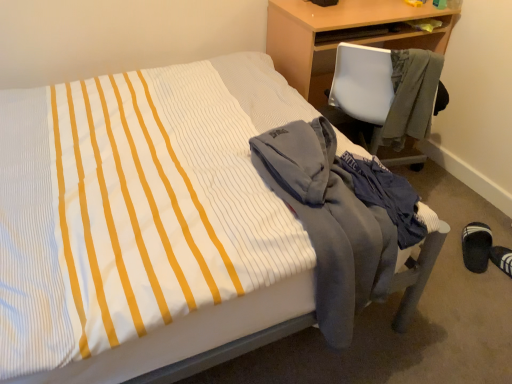
Question: Does point (422, 132) appear closer or farther from the camera than point (490, 244)?

Choices:
 (A) farther
 (B) closer

Answer: (B)

Question: Is gray fleece jacket at right, which is the second jacket from left to right, spatially inside black fabric slipper at lower right, or outside of it?

Choices:
 (A) inside
 (B) outside

Answer: (B)

Question: Which object is positioned farthest from the gray fleece jacket at right, the second jacket when ordered from bottom to top?

Choices:
 (A) gray fleece jacket at lower right, the second jacket from the top
 (B) black fabric slipper at lower right
 (C) wooden desk at upper right

Answer: (A)

Question: Estimate the real-world distances between objects in this image. Which object is closer to the wooden desk at upper right?

Choices:
 (A) gray fleece jacket at right, the second jacket when ordered from bottom to top
 (B) black fabric slipper at lower right
 (C) gray fleece jacket at lower right, which appears as the 2th jacket when viewed from the right

Answer: (A)